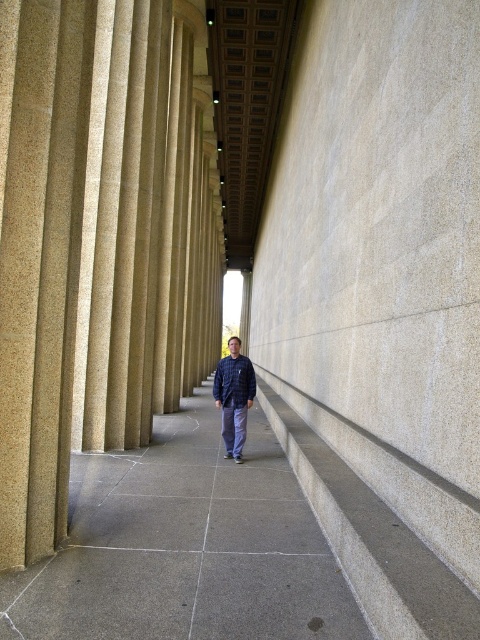
Question: Does gray concrete pavement at center lie behind dark blue cotton sweatshirt at center?

Choices:
 (A) no
 (B) yes

Answer: (A)

Question: Which point is closer to the camera taking this photo?

Choices:
 (A) (233, 513)
 (B) (232, 390)
 (C) (411, 624)
 (D) (224, 360)

Answer: (C)

Question: Which point appears closest to the camera in this image?

Choices:
 (A) (36, 572)
 (B) (448, 627)
 (C) (242, 413)

Answer: (B)

Question: Can you confirm if gray concrete pavement at center is smaller than dark blue cotton sweatshirt at center?

Choices:
 (A) yes
 (B) no

Answer: (B)

Question: Which object is closer to the camera taking this photo?

Choices:
 (A) gray concrete pavement at center
 (B) dark blue jacket at center
 (C) dark blue cotton sweatshirt at center
 (D) gray concrete stairs at center

Answer: (D)

Question: Is gray concrete pavement at center wider than dark blue cotton sweatshirt at center?

Choices:
 (A) yes
 (B) no

Answer: (A)